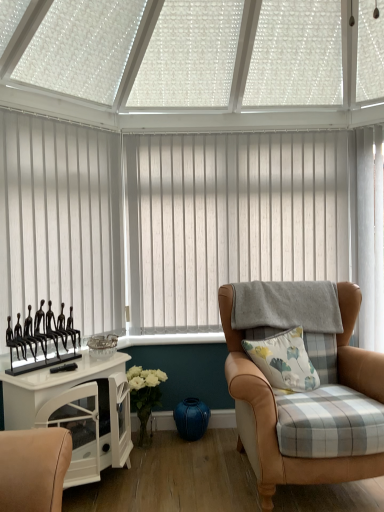
Question: Considering the relative positions of white vertical blinds at left, which appears as the first window blind when viewed from the front, and white glossy cabinet at left in the image provided, is white vertical blinds at left, which appears as the first window blind when viewed from the front, to the left of white glossy cabinet at left from the viewer's perspective?

Choices:
 (A) no
 (B) yes

Answer: (B)

Question: From the image's perspective, is white vertical blinds at left, which is counted as the 1th window blind, starting from the left, over white glossy cabinet at left?

Choices:
 (A) no
 (B) yes

Answer: (B)

Question: From the image's perspective, does white vertical blinds at left, which appears as the first window blind when viewed from the front, appear lower than white glossy cabinet at left?

Choices:
 (A) no
 (B) yes

Answer: (A)

Question: Would you say white vertical blinds at left, which is the 2th window blind from back to front, is outside white glossy cabinet at left?

Choices:
 (A) yes
 (B) no

Answer: (A)

Question: Can you confirm if white vertical blinds at left, which appears as the first window blind when viewed from the front, is taller than white glossy cabinet at left?

Choices:
 (A) yes
 (B) no

Answer: (A)

Question: Is white glossy cabinet at left a part of white vertical blinds at left, which appears as the first window blind when viewed from the front?

Choices:
 (A) no
 (B) yes

Answer: (A)

Question: Is black metal figurines at left at the back of white glossy cabinet at left?

Choices:
 (A) yes
 (B) no

Answer: (B)

Question: Considering the relative sizes of white glossy cabinet at left and black metal figurines at left in the image provided, is white glossy cabinet at left taller than black metal figurines at left?

Choices:
 (A) yes
 (B) no

Answer: (A)

Question: Considering the relative positions of white glossy cabinet at left and black metal figurines at left in the image provided, is white glossy cabinet at left to the right of black metal figurines at left from the viewer's perspective?

Choices:
 (A) yes
 (B) no

Answer: (A)

Question: Is white glossy cabinet at left aimed at black metal figurines at left?

Choices:
 (A) no
 (B) yes

Answer: (A)

Question: Is black metal figurines at left completely or partially inside white glossy cabinet at left?

Choices:
 (A) no
 (B) yes

Answer: (A)

Question: Would you say white glossy cabinet at left is a long distance from black metal figurines at left?

Choices:
 (A) no
 (B) yes

Answer: (A)

Question: From a real-world perspective, is white vertical blinds at center, the 2th window blind positioned from the front, physically below white floral-patterned cushion at center-right?

Choices:
 (A) no
 (B) yes

Answer: (A)